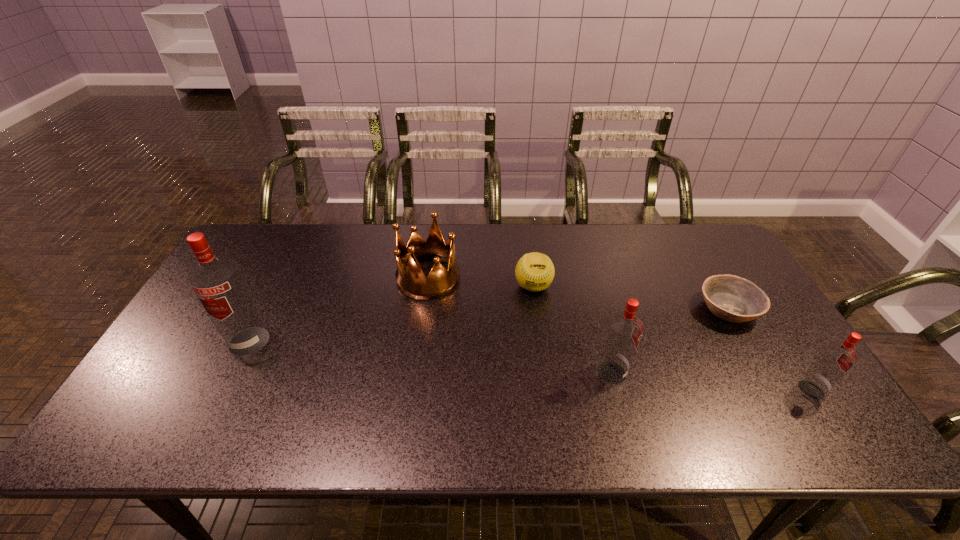
Where is `free point at the near edge`? free point at the near edge is located at coordinates (317, 392).

Identify the location of vacant space at the right edge of the desktop. This screenshot has height=540, width=960. (766, 348).

In the image, there is a desktop. Where is `vacant space at the far left corner`? This screenshot has height=540, width=960. vacant space at the far left corner is located at coordinates (259, 228).

At what (x,y) coordinates should I click in order to perform the action: click on free spot between the crown and the softball. Please return your answer as a coordinate pair (x, y). The height and width of the screenshot is (540, 960). Looking at the image, I should click on (481, 282).

What are the coordinates of `unoccupied position between the softball and the second vodka from left to right` in the screenshot? It's located at (572, 329).

Locate an element on the screen. vacant area between the second shortest object and the fifth object from right to left is located at coordinates (481, 282).

Where is `free spot between the second shortest object and the shortest vodka`? The height and width of the screenshot is (540, 960). free spot between the second shortest object and the shortest vodka is located at coordinates (672, 338).

Find the location of a particular element. The width and height of the screenshot is (960, 540). vacant area between the crown and the fourth object from right to left is located at coordinates (x=481, y=282).

I want to click on vacant area that lies between the second shortest vodka and the rightmost vodka, so click(711, 381).

Locate an element on the screen. This screenshot has height=540, width=960. free point between the leftmost object and the crown is located at coordinates (339, 309).